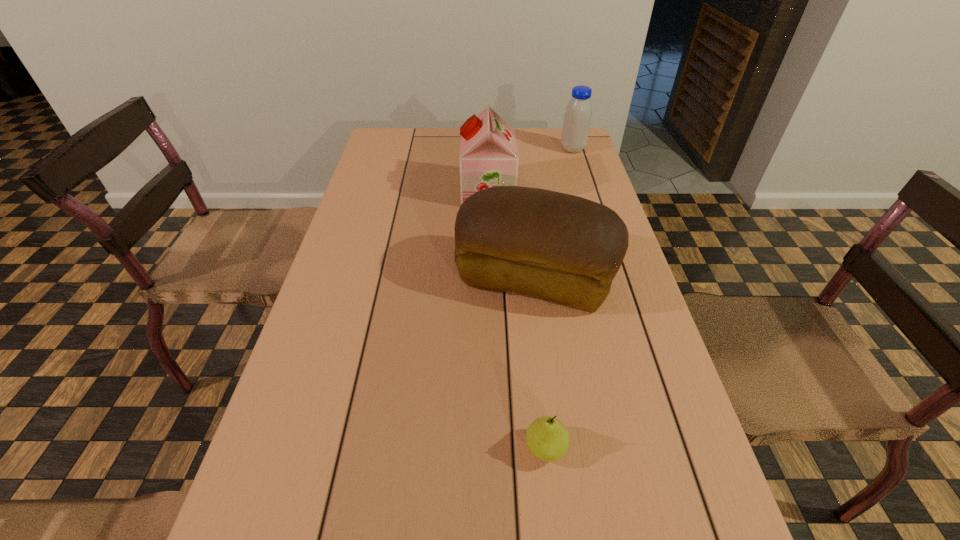
This screenshot has width=960, height=540. In order to click on the third nearest object in this screenshot , I will do `click(488, 158)`.

Find the location of a particular element. The image size is (960, 540). the taller soya milk is located at coordinates pyautogui.click(x=488, y=158).

Find the location of a particular element. The image size is (960, 540). bread is located at coordinates (558, 247).

At what (x,y) coordinates should I click in order to perform the action: click on the farthest object. Please return your answer as a coordinate pair (x, y). The width and height of the screenshot is (960, 540). Looking at the image, I should click on (577, 117).

At what (x,y) coordinates should I click in order to perform the action: click on the right soya milk. Please return your answer as a coordinate pair (x, y). Image resolution: width=960 pixels, height=540 pixels. Looking at the image, I should click on (577, 117).

Where is `the nearest object`? the nearest object is located at coordinates (547, 438).

Where is `the shortest object`? The height and width of the screenshot is (540, 960). the shortest object is located at coordinates (547, 438).

In order to click on free region located 0.310m with the cap open on the nearer soya milk in this screenshot , I will do `click(360, 192)`.

Find the location of a particular element. free region located 0.280m with the cap open on the nearer soya milk is located at coordinates (370, 192).

Where is `vacant space situated with the cap open on the nearer soya milk`? vacant space situated with the cap open on the nearer soya milk is located at coordinates (363, 192).